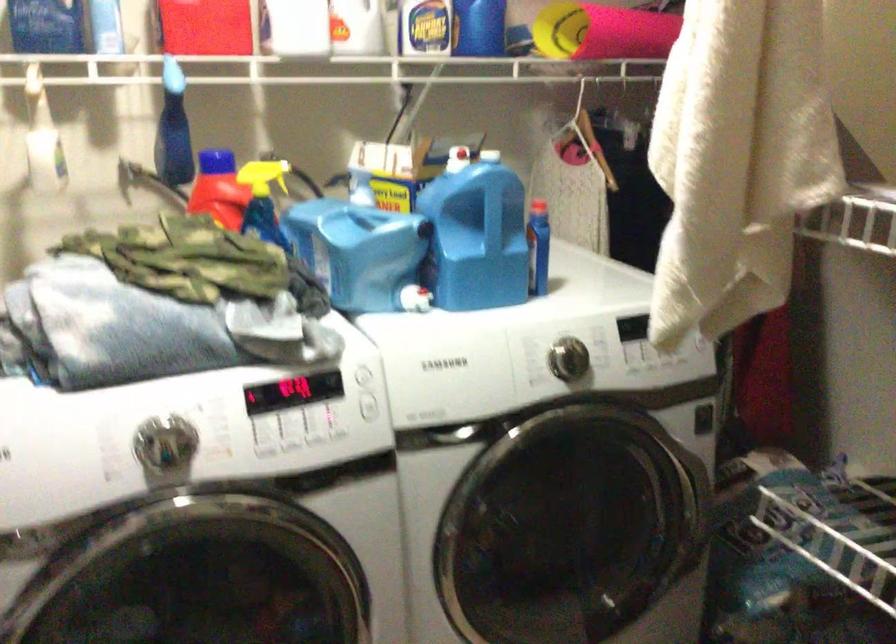
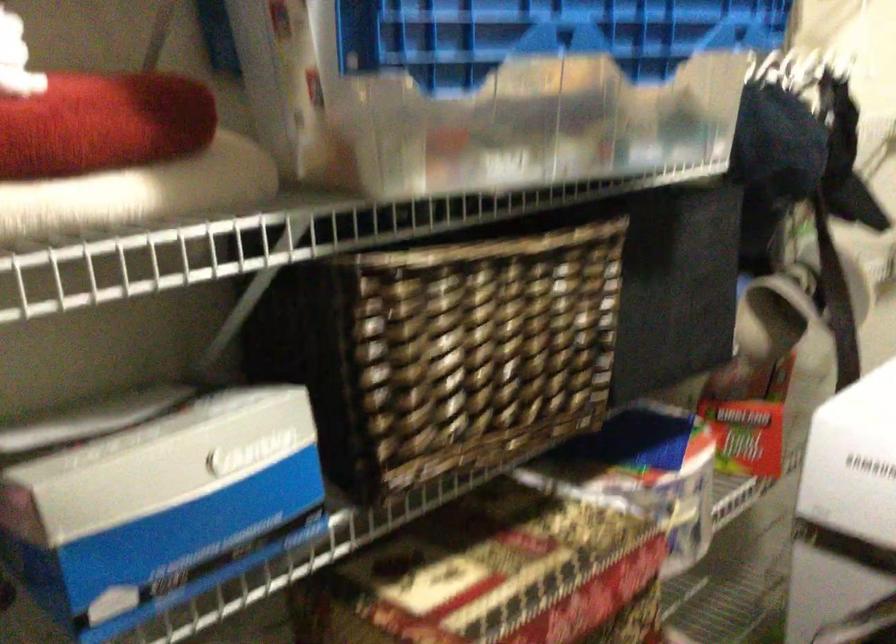
Question: The images are taken continuously from a first-person perspective. In which direction is your viewpoint rotating?

Choices:
 (A) Left
 (B) Right
 (C) Up
 (D) Down

Answer: (A)